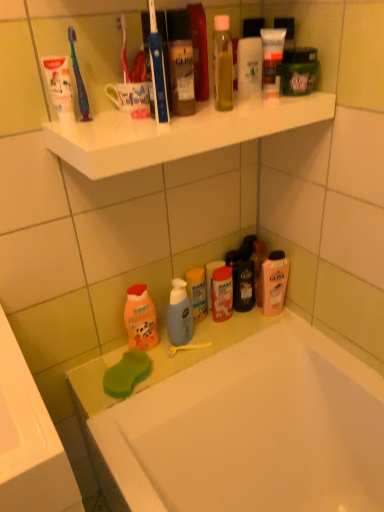
Identify the location of free space in front of translucent plastic shampoo bottle at lower center, the 1th toiletry from the bottom. (195, 346).